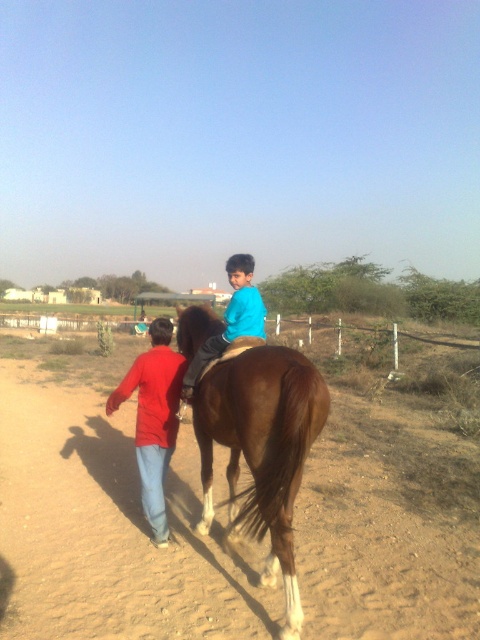
Is brown dirt field at center smaller than blue matte shirt at center?

Yes.

Who is positioned more to the right, brown dirt field at center or blue matte shirt at center?

From the viewer's perspective, blue matte shirt at center appears more on the right side.

Find the location of `brown dirt field at center`. brown dirt field at center is located at coordinates (108, 529).

Does red cotton shirt at left have a lesser width compared to blue matte shirt at center?

Yes, red cotton shirt at left is thinner than blue matte shirt at center.

Is point (143, 499) more distant than point (228, 308)?

Yes, it is behind point (228, 308).

I want to click on red cotton shirt at left, so click(x=154, y=419).

Between brown dirt field at center and brown glossy horse at center, which one is positioned higher?

brown glossy horse at center is above.

Can you confirm if brown dirt field at center is positioned below brown glossy horse at center?

Indeed, brown dirt field at center is positioned under brown glossy horse at center.

Describe the element at coordinates (108, 529) in the screenshot. I see `brown dirt field at center` at that location.

This screenshot has width=480, height=640. What are the coordinates of `brown dirt field at center` in the screenshot? It's located at (108, 529).